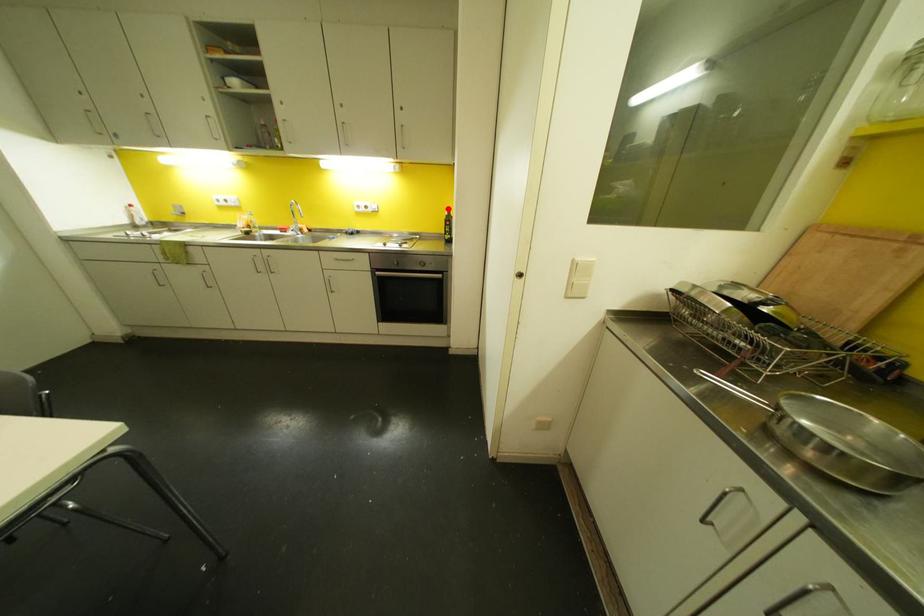
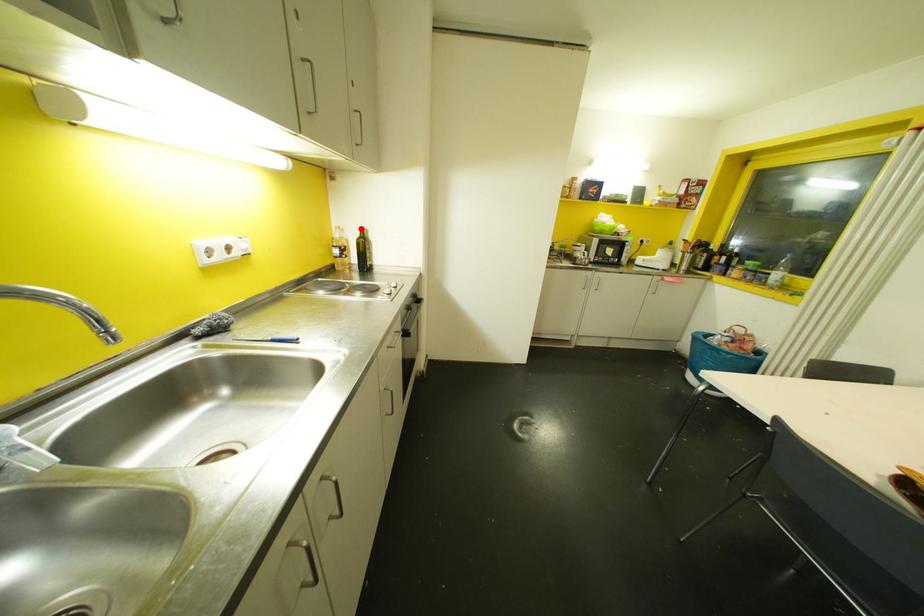
I am providing you with two images of the same scene from different viewpoints. A red point is marked on the first image and another point is marked on the second image. Is the marked point in image1 the same physical position as the marked point in image2?

Yes